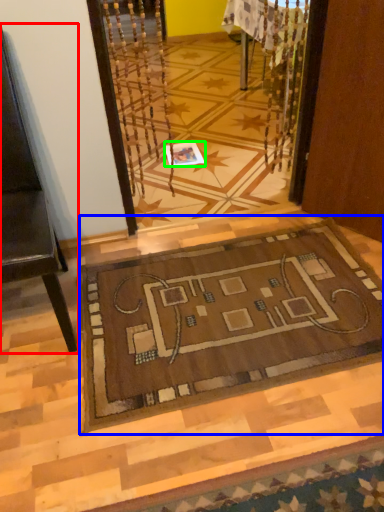
Question: Which object is positioned closest to furniture (highlighted by a red box)? Select from mat (highlighted by a blue box) and square (highlighted by a green box).

Choices:
 (A) mat
 (B) square

Answer: (A)